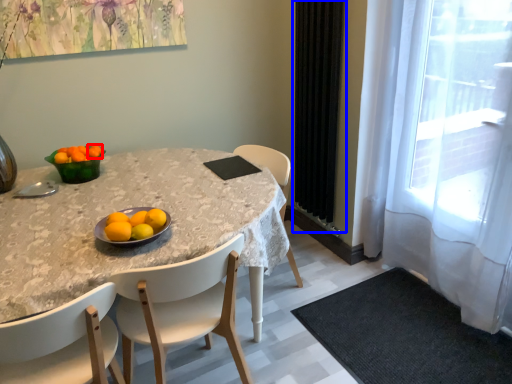
Question: Among these objects, which one is farthest to the camera, tangerine (highlighted by a red box) or curtain (highlighted by a blue box)?

Choices:
 (A) tangerine
 (B) curtain

Answer: (B)